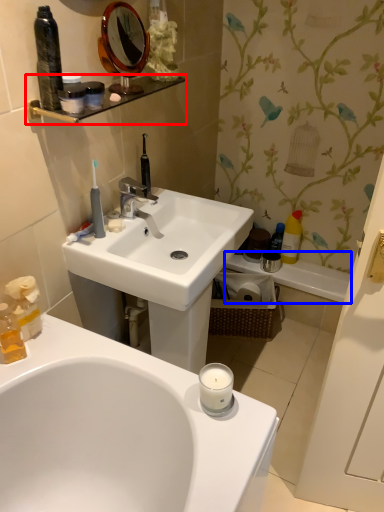
Question: Which object appears farthest to the camera in this image, balustrade (highlighted by a red box) or bath (highlighted by a blue box)?

Choices:
 (A) balustrade
 (B) bath

Answer: (B)